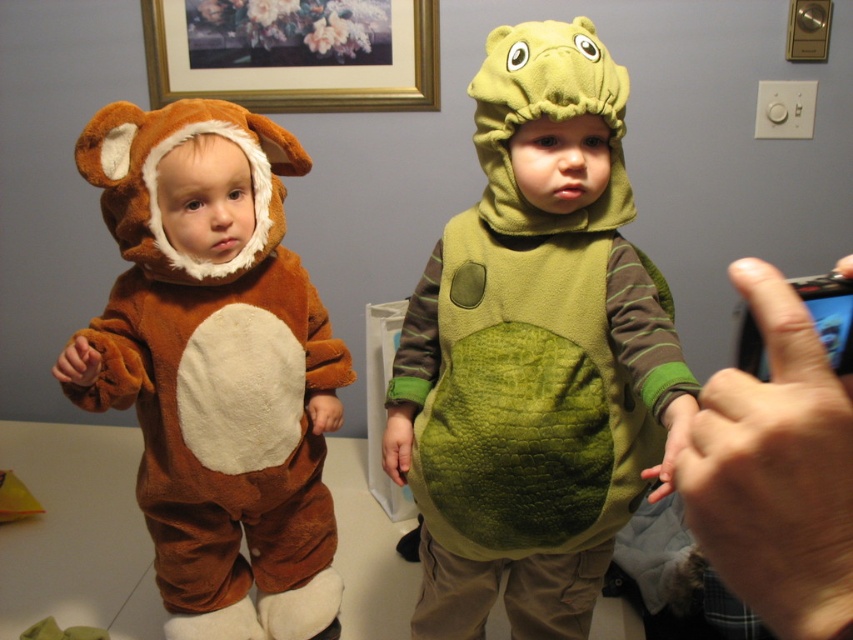
Question: Does brown plush bear at left have a greater width compared to smooth black phone at right?

Choices:
 (A) yes
 (B) no

Answer: (A)

Question: Estimate the real-world distances between objects in this image. Which object is farther from the smooth black phone at right?

Choices:
 (A) velvety green dinosaur costume at center
 (B) brown plush bear at left

Answer: (B)

Question: Which of the following is the farthest from the observer?

Choices:
 (A) (830, 397)
 (B) (572, 102)

Answer: (B)

Question: Which object is the closest to the velvety green dinosaur costume at center?

Choices:
 (A) smooth black phone at right
 (B) brown plush bear at left

Answer: (B)

Question: Does velvety green dinosaur costume at center appear under smooth black phone at right?

Choices:
 (A) no
 (B) yes

Answer: (B)

Question: Considering the relative positions of velvety green dinosaur costume at center and brown plush bear at left in the image provided, where is velvety green dinosaur costume at center located with respect to brown plush bear at left?

Choices:
 (A) left
 (B) right

Answer: (B)